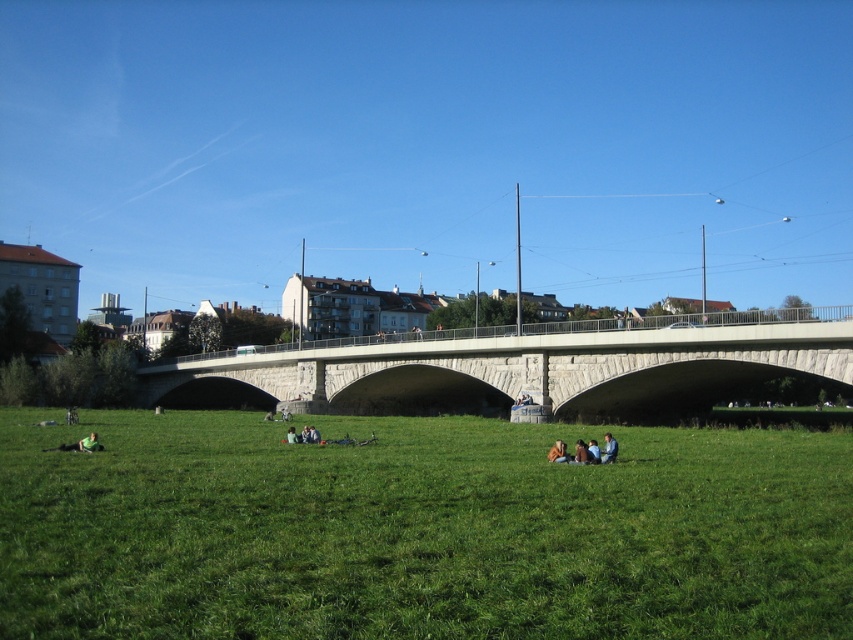
You are standing at the origin point of the image coordinate system, which is the bottom left corner. The light brown leather jacket at center is located at point 0.708, 0.655. If you want to walk towards the jacket, in which direction should you move first?

Since the light brown leather jacket at center is located at coordinates 0.708 on the x axis and 0.655 on the y axis, you should first move towards the right and upwards to reach it.

You are a photographer trying to capture a candid shot of the light brown leather jacket at center and blue denim jeans at lower center. Since you want both subjects to be clearly visible in the frame, which one should you focus on first to ensure proper focus, considering their size in the image?

You should focus on the blue denim jeans at lower center first because it occupies more space in the image than the light brown leather jacket at center, ensuring that the larger subject is in focus before adjusting for the smaller one.